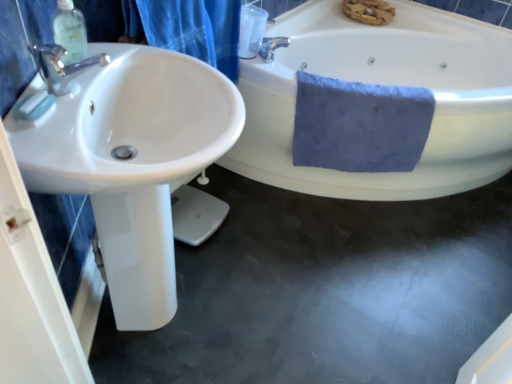
Image resolution: width=512 pixels, height=384 pixels. I want to click on white glossy bathtub at upper right, so (x=385, y=84).

At what (x,y) coordinates should I click in order to perform the action: click on white glossy bathtub at upper right. Please return your answer as a coordinate pair (x, y). The height and width of the screenshot is (384, 512). Looking at the image, I should click on [x=385, y=84].

Which object is further away from the camera, clear plastic soap dispenser at upper left or white glossy sink at left?

clear plastic soap dispenser at upper left.

Considering the sizes of objects clear plastic soap dispenser at upper left and white glossy sink at left in the image provided, who is thinner, clear plastic soap dispenser at upper left or white glossy sink at left?

Thinner between the two is clear plastic soap dispenser at upper left.

Is clear plastic soap dispenser at upper left surrounding white glossy sink at left?

No.

The width and height of the screenshot is (512, 384). I want to click on soap dispenser behind the white glossy sink at left, so click(70, 31).

You are a GUI agent. You are given a task and a screenshot of the screen. Output one action in this format:
    pyautogui.click(x=<x>, y=<y>)
    Task: Click on the sink above the white glossy bathtub at upper right (from a real-world perspective)
    The width and height of the screenshot is (512, 384).
    Given the screenshot: What is the action you would take?
    pyautogui.click(x=130, y=160)

Is white glossy sink at left with white glossy bathtub at upper right?

No, white glossy sink at left is not making contact with white glossy bathtub at upper right.

Does white glossy sink at left have a greater height compared to white glossy bathtub at upper right?

Indeed, white glossy sink at left has a greater height compared to white glossy bathtub at upper right.

Is point (192, 99) closer to viewer compared to point (237, 35)?

Yes, point (192, 99) is in front of point (237, 35).

Find the location of a particular element. Image resolution: width=512 pixels, height=384 pixels. shower curtain lying above the white glossy sink at left (from the image's perspective) is located at coordinates (197, 29).

Which is correct: white glossy sink at left is inside blue fabric shower curtain at upper left, or outside of it?

white glossy sink at left is not enclosed by blue fabric shower curtain at upper left.

Is white glossy sink at left oriented towards blue fabric shower curtain at upper left?

No, white glossy sink at left is not aimed at blue fabric shower curtain at upper left.

Is blue fabric shower curtain at upper left further to camera compared to white glossy bathtub at upper right?

No.

Who is smaller, blue fabric shower curtain at upper left or white glossy bathtub at upper right?

With smaller size is blue fabric shower curtain at upper left.

In terms of width, does blue fabric shower curtain at upper left look wider or thinner when compared to white glossy bathtub at upper right?

Clearly, blue fabric shower curtain at upper left has less width compared to white glossy bathtub at upper right.

Is blue fabric shower curtain at upper left taller than white glossy bathtub at upper right?

Incorrect, the height of blue fabric shower curtain at upper left is not larger of that of white glossy bathtub at upper right.

From the image's perspective, would you say blue fabric shower curtain at upper left is positioned over white glossy sink at left?

Indeed, from the image's perspective, blue fabric shower curtain at upper left is shown above white glossy sink at left.

Is blue fabric shower curtain at upper left at the right side of white glossy sink at left?

Yes, blue fabric shower curtain at upper left is to the right of white glossy sink at left.

Where is `sink below the blue fabric shower curtain at upper left (from the image's perspective)`? sink below the blue fabric shower curtain at upper left (from the image's perspective) is located at coordinates (130, 160).

From their relative heights in the image, would you say blue soft towel at right is taller or shorter than blue fabric shower curtain at upper left?

Clearly, blue soft towel at right is taller compared to blue fabric shower curtain at upper left.

From the image's perspective, is blue soft towel at right located beneath blue fabric shower curtain at upper left?

Correct, blue soft towel at right appears lower than blue fabric shower curtain at upper left in the image.

Looking at this image, how much distance is there between blue soft towel at right and blue fabric shower curtain at upper left?

blue soft towel at right and blue fabric shower curtain at upper left are 20.27 inches apart.

In the image, is blue soft towel at right on the left side or the right side of blue fabric shower curtain at upper left?

blue soft towel at right is positioned on blue fabric shower curtain at upper left's right side.

Does blue fabric shower curtain at upper left turn towards clear plastic soap dispenser at upper left?

No, blue fabric shower curtain at upper left is not turned towards clear plastic soap dispenser at upper left.

Between point (236, 6) and point (56, 42), which one is positioned in front?

Point (56, 42)

From their relative heights in the image, would you say blue fabric shower curtain at upper left is taller or shorter than clear plastic soap dispenser at upper left?

In the image, blue fabric shower curtain at upper left appears to be taller than clear plastic soap dispenser at upper left.

Is blue fabric shower curtain at upper left not close to clear plastic soap dispenser at upper left?

They are positioned close to each other.

You are a GUI agent. You are given a task and a screenshot of the screen. Output one action in this format:
    pyautogui.click(x=<x>, y=<y>)
    Task: Click on the sink located in front of the clear plastic soap dispenser at upper left
    This screenshot has height=384, width=512.
    Given the screenshot: What is the action you would take?
    [130, 160]

This screenshot has width=512, height=384. Find the location of `bathtub below the white glossy sink at left (from a real-world perspective)`. bathtub below the white glossy sink at left (from a real-world perspective) is located at coordinates (385, 84).

Estimate the real-world distances between objects in this image. Which object is further from white glossy sink at left, clear plastic soap dispenser at upper left or blue soft towel at right?

Based on the image, blue soft towel at right appears to be further to white glossy sink at left.

Looking at the image, which one is located closer to white glossy sink at left, clear plastic soap dispenser at upper left or white glossy bathtub at upper right?

clear plastic soap dispenser at upper left is closer to white glossy sink at left.

From the picture: Which object lies nearer to the anchor point clear plastic soap dispenser at upper left, blue soft towel at right or white glossy sink at left?

white glossy sink at left lies closer to clear plastic soap dispenser at upper left than the other object.

Based on their spatial positions, is blue soft towel at right or blue fabric shower curtain at upper left further from white glossy bathtub at upper right?

Among the two, blue fabric shower curtain at upper left is located further to white glossy bathtub at upper right.

Which object lies nearer to the anchor point white glossy bathtub at upper right, blue fabric shower curtain at upper left or white glossy sink at left?

The object closer to white glossy bathtub at upper right is blue fabric shower curtain at upper left.

From the image, which object appears to be nearer to blue fabric shower curtain at upper left, clear plastic soap dispenser at upper left or white glossy bathtub at upper right?

Based on the image, clear plastic soap dispenser at upper left appears to be nearer to blue fabric shower curtain at upper left.

Considering their positions, is white glossy bathtub at upper right positioned closer to blue fabric shower curtain at upper left than blue soft towel at right?

Based on the image, blue soft towel at right appears to be nearer to blue fabric shower curtain at upper left.

Estimate the real-world distances between objects in this image. Which object is closer to blue soft towel at right, white glossy sink at left or white glossy bathtub at upper right?

white glossy bathtub at upper right.

Identify the location of shower curtain between white glossy sink at left and blue soft towel at right in the front-back direction. (197, 29).

At what (x,y) coordinates should I click in order to perform the action: click on soap dispenser between blue fabric shower curtain at upper left and white glossy sink at left from top to bottom. Please return your answer as a coordinate pair (x, y). This screenshot has width=512, height=384. Looking at the image, I should click on (70, 31).

What are the coordinates of `bath towel situated between blue fabric shower curtain at upper left and white glossy bathtub at upper right from left to right` in the screenshot? It's located at (360, 125).

What are the coordinates of `shower curtain between clear plastic soap dispenser at upper left and blue soft towel at right` in the screenshot? It's located at (197, 29).